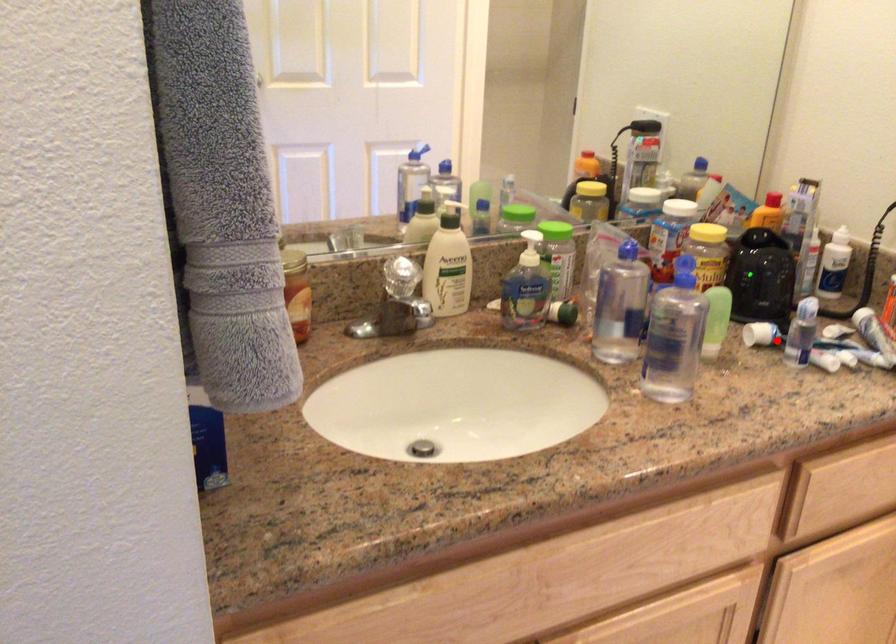
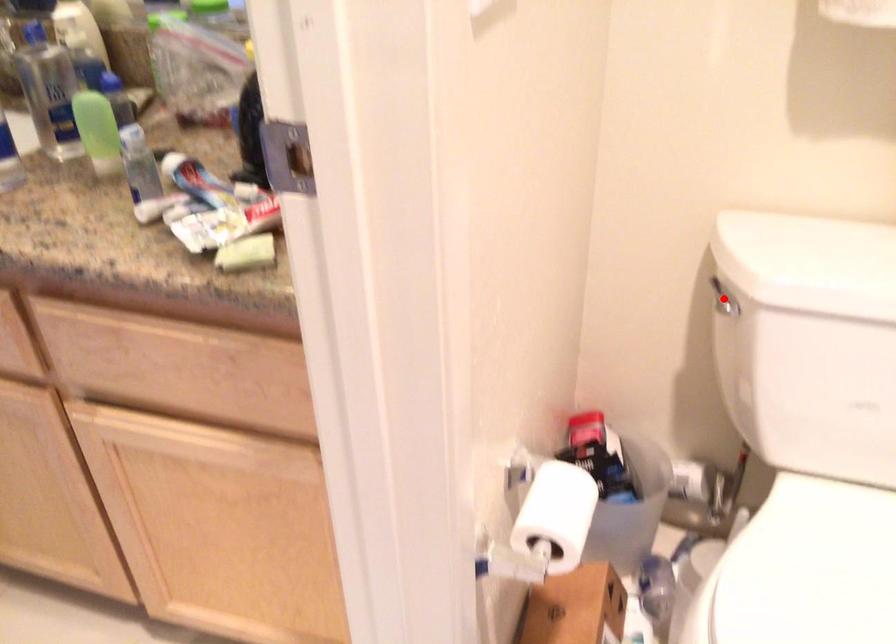
I am providing you with two images of the same scene from different viewpoints. A red point is marked on the first image and another point is marked on the second image. Do the highlighted points in image1 and image2 indicate the same real-world spot?

No